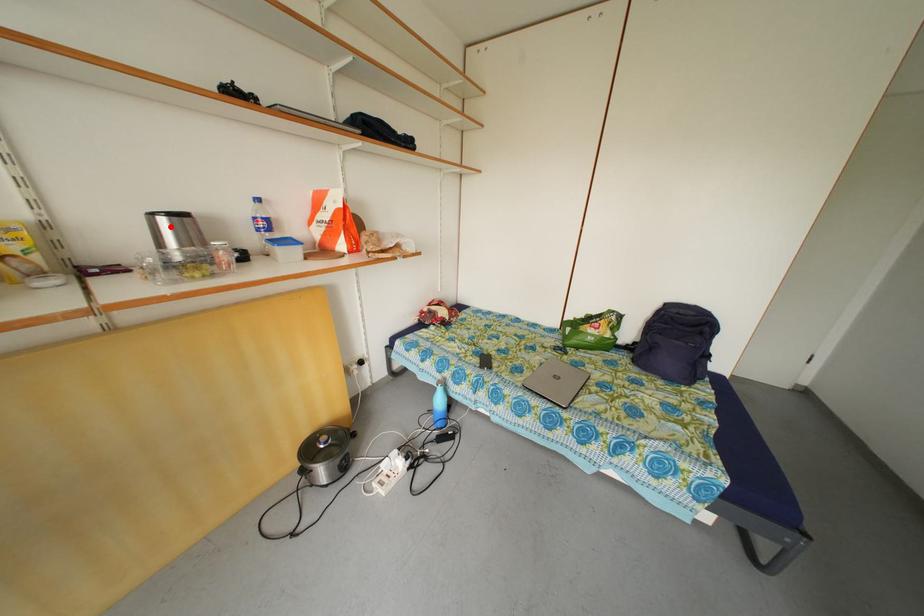
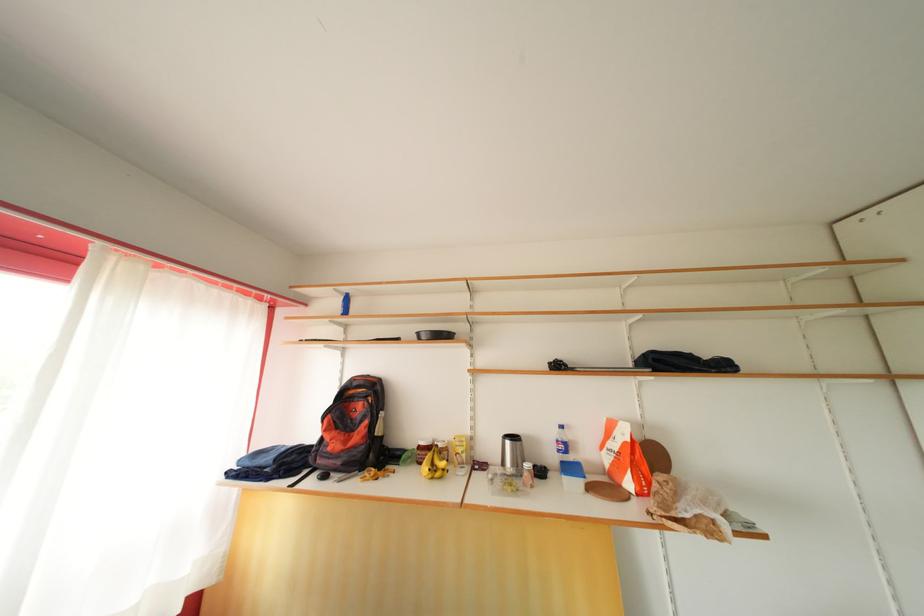
Where in the second image is the point corresponding to the highlighted location from the first image?

(515, 448)